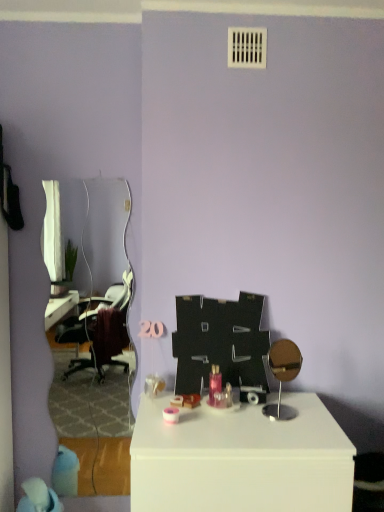
Question: Is white glossy mirror at left taller than blue fabric bean bag chair at lower left?

Choices:
 (A) no
 (B) yes

Answer: (B)

Question: Does white glossy mirror at left appear on the left side of blue fabric bean bag chair at lower left?

Choices:
 (A) yes
 (B) no

Answer: (B)

Question: Are white glossy mirror at left and blue fabric bean bag chair at lower left beside each other?

Choices:
 (A) no
 (B) yes

Answer: (A)

Question: From the image's perspective, is white glossy mirror at left above blue fabric bean bag chair at lower left?

Choices:
 (A) no
 (B) yes

Answer: (B)

Question: Is white glossy mirror at left turned away from blue fabric bean bag chair at lower left?

Choices:
 (A) no
 (B) yes

Answer: (B)

Question: Is white glossy mirror at left located outside blue fabric bean bag chair at lower left?

Choices:
 (A) no
 (B) yes

Answer: (B)

Question: Can you confirm if white glossy table at center is bigger than white glossy mirror at left?

Choices:
 (A) yes
 (B) no

Answer: (A)

Question: Is white glossy mirror at left located within white glossy table at center?

Choices:
 (A) yes
 (B) no

Answer: (B)

Question: Does white glossy table at center touch white glossy mirror at left?

Choices:
 (A) yes
 (B) no

Answer: (B)

Question: Is white glossy table at center shorter than white glossy mirror at left?

Choices:
 (A) no
 (B) yes

Answer: (B)

Question: Is white glossy table at center positioned with its back to white glossy mirror at left?

Choices:
 (A) no
 (B) yes

Answer: (A)

Question: Considering the relative positions of white glossy table at center and white glossy mirror at left in the image provided, is white glossy table at center to the right of white glossy mirror at left from the viewer's perspective?

Choices:
 (A) yes
 (B) no

Answer: (A)

Question: Is white glossy table at center a part of white glossy mirror at left?

Choices:
 (A) yes
 (B) no

Answer: (B)